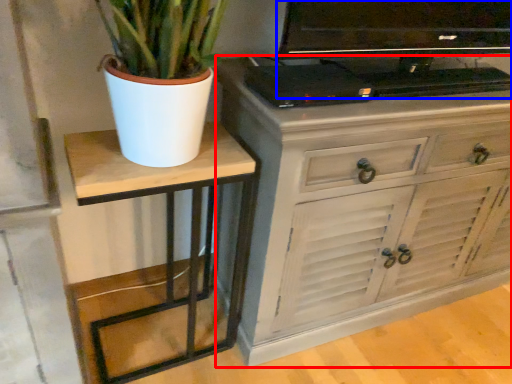
Question: Among these objects, which one is nearest to the camera, chest of drawers (highlighted by a red box) or television (highlighted by a blue box)?

Choices:
 (A) chest of drawers
 (B) television

Answer: (B)